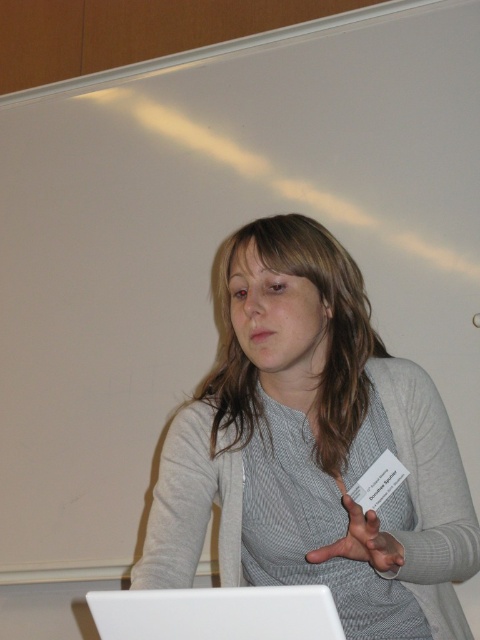
You are a speaker who needs to place your matte gray hand at center on top of the white plastic laptop at lower center. Is the laptop wide enough to accommodate your hand without hanging off the edge?

The white plastic laptop at lower center might be wider than matte gray hand at center, so it could potentially accommodate the hand without overhang, but there is uncertainty due to the description using the word

Based on the scene description, can you determine the relative position of the gray matte sweater at center and the white plastic laptop at lower center? Specifically, is the sweater positioned to the left or right of the laptop?

The gray matte sweater at center is to the right of the white plastic laptop at lower center according to the description.

You are an attendee at this presentation. You want to take a photo of the presenter using your phone. However, you need to ensure that both the white plastic laptop at lower center and the matte gray hand at center are visible in the frame. Which object should you focus on to make sure both are in focus?

You should focus on the matte gray hand at center because it is farther from the viewer than the white plastic laptop at lower center. By focusing on the farther object, both objects will be in focus.